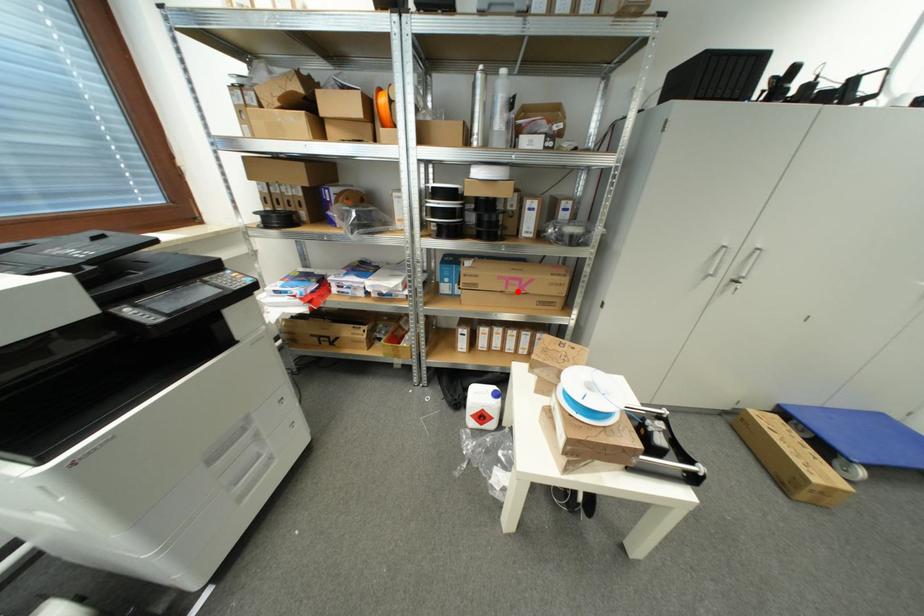
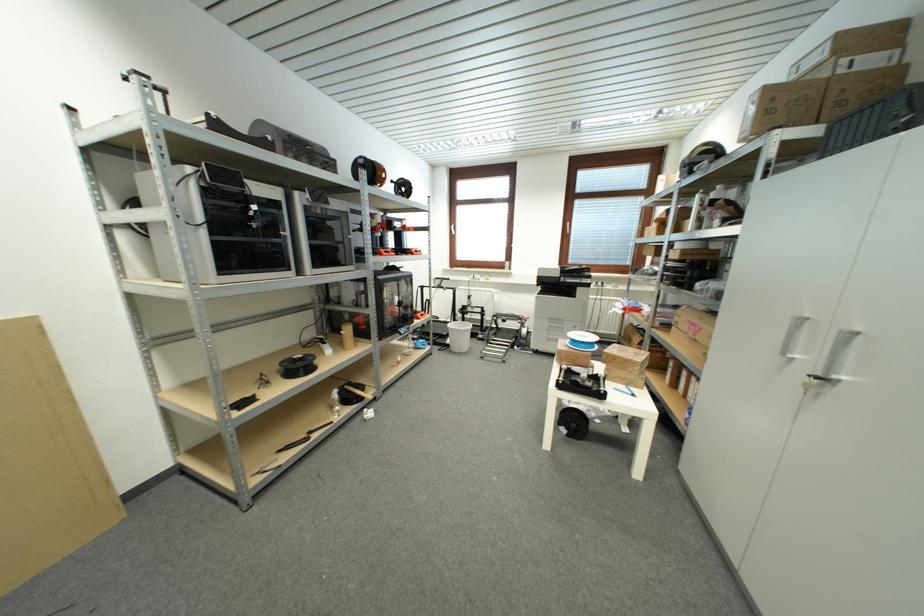
The point at the highlighted location is marked in the first image. Where is the corresponding point in the second image?

(696, 334)